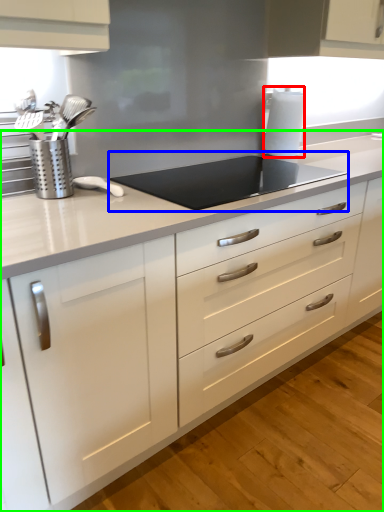
Question: Which object is the closest to the paper towel (highlighted by a red box)? Choose among these: gas stove (highlighted by a blue box) or countertop (highlighted by a green box).

Choices:
 (A) gas stove
 (B) countertop

Answer: (A)